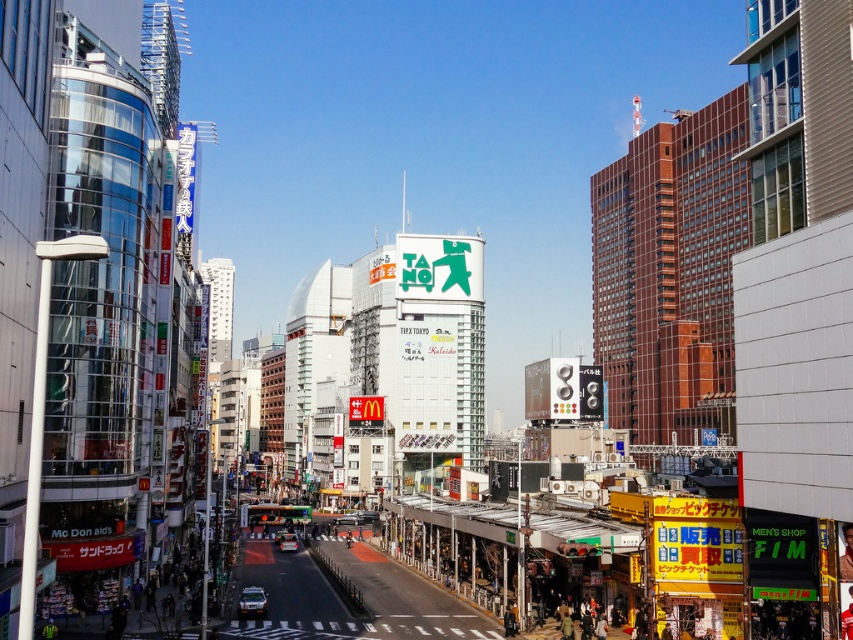
Question: Which point is farther to the camera?

Choices:
 (A) (340, 520)
 (B) (287, 550)

Answer: (A)

Question: Considering the relative positions of shiny silver car at center and silver metallic car at center in the image provided, where is shiny silver car at center located with respect to silver metallic car at center?

Choices:
 (A) left
 (B) right

Answer: (A)

Question: Which of the following is the farthest from the observer?

Choices:
 (A) (260, 600)
 (B) (345, 520)

Answer: (B)

Question: Which of these objects is positioned closest to the shiny silver car at center?

Choices:
 (A) silver metallic car at center
 (B) silver metallic car at lower left

Answer: (A)

Question: Can you confirm if silver metallic car at lower left is smaller than silver metallic car at center?

Choices:
 (A) yes
 (B) no

Answer: (A)

Question: Does silver metallic car at lower left lie behind silver metallic car at center?

Choices:
 (A) no
 (B) yes

Answer: (A)